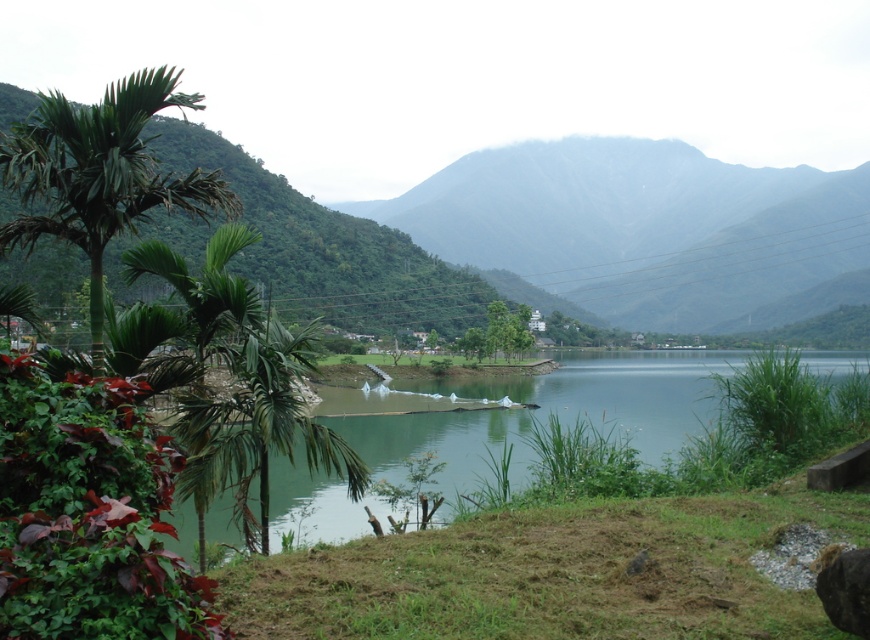
Is green matte mountain at center closer to camera compared to green leafy palm at left?

No.

Does point (815, 282) come behind point (126, 113)?

That is True.

At what (x,y) coordinates should I click in order to perform the action: click on green matte mountain at center. Please return your answer as a coordinate pair (x, y). The width and height of the screenshot is (870, 640). Looking at the image, I should click on (640, 227).

Does green leafy palm tree at left appear on the right side of green leafy tree at center?

No, green leafy palm tree at left is not to the right of green leafy tree at center.

How much distance is there between green leafy palm tree at left and green leafy tree at center?

green leafy palm tree at left is 71.47 meters away from green leafy tree at center.

Is point (320, 460) positioned after point (492, 324)?

No, it is not.

Image resolution: width=870 pixels, height=640 pixels. Identify the location of green leafy palm tree at left. (258, 428).

Is point (174, 204) farther from camera compared to point (493, 316)?

No, (174, 204) is closer to viewer.

At what (x,y) coordinates should I click in order to perform the action: click on green leafy palm at left. Please return your answer as a coordinate pair (x, y). The width and height of the screenshot is (870, 640). Looking at the image, I should click on (99, 173).